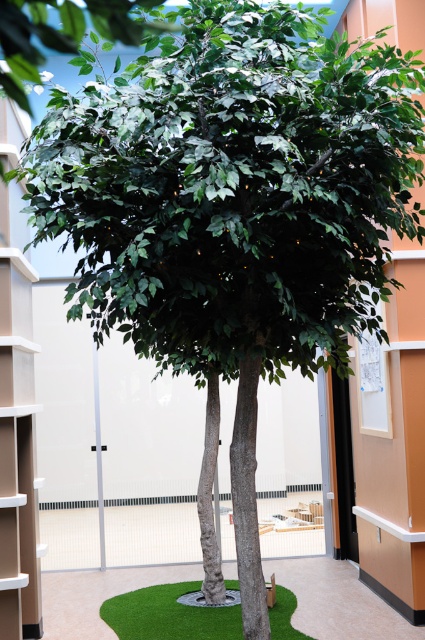
Who is lower down, green artificial turf at center or green matte tree trunk at center?

green matte tree trunk at center

Who is positioned more to the left, green artificial turf at center or green matte tree trunk at center?

green artificial turf at center

This screenshot has width=425, height=640. Describe the element at coordinates (170, 614) in the screenshot. I see `green artificial turf at center` at that location.

This screenshot has width=425, height=640. I want to click on green artificial turf at center, so click(x=170, y=614).